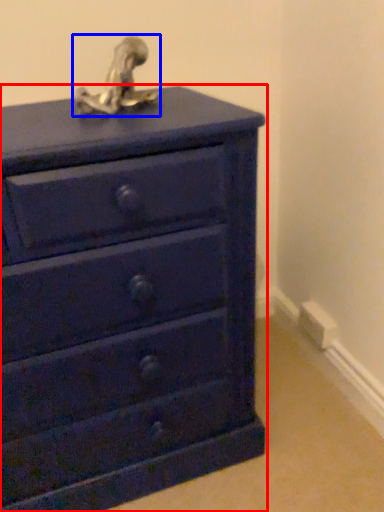
Question: Which point is further to the camera, chest of drawers (highlighted by a red box) or sculpture (highlighted by a blue box)?

Choices:
 (A) chest of drawers
 (B) sculpture

Answer: (B)